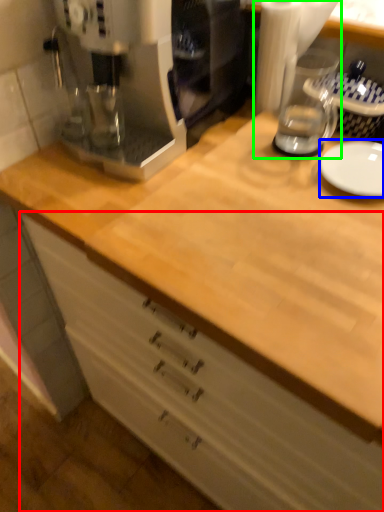
Question: Which object is the closest to the cabinetry (highlighted by a red box)? Choose among these: plate (highlighted by a blue box) or blender (highlighted by a green box).

Choices:
 (A) plate
 (B) blender

Answer: (A)